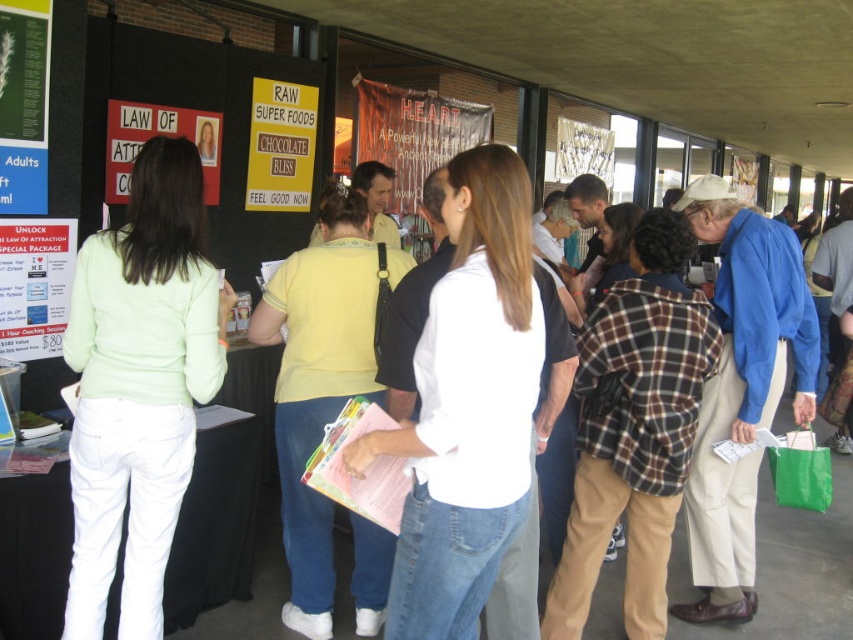
The image size is (853, 640). What do you see at coordinates (22, 68) in the screenshot? I see `green matte poster at upper left` at bounding box center [22, 68].

Where is `green matte poster at upper left`? The image size is (853, 640). green matte poster at upper left is located at coordinates (22, 68).

Which is more to the right, yellow paper sign at center or matte red poster at upper left?

From the viewer's perspective, yellow paper sign at center appears more on the right side.

Image resolution: width=853 pixels, height=640 pixels. What do you see at coordinates (281, 145) in the screenshot?
I see `yellow paper sign at center` at bounding box center [281, 145].

I want to click on yellow paper sign at center, so click(x=281, y=145).

Identify the location of yellow paper sign at center. (281, 145).

Consider the image. Can you confirm if matte red poster at upper left is positioned below white paper at upper center?

Yes.

Which of these two, matte red poster at upper left or white paper at upper center, stands shorter?

matte red poster at upper left is shorter.

The width and height of the screenshot is (853, 640). Describe the element at coordinates (158, 134) in the screenshot. I see `matte red poster at upper left` at that location.

You are a GUI agent. You are given a task and a screenshot of the screen. Output one action in this format:
    pyautogui.click(x=<x>, y=<y>)
    Task: Click on the matte red poster at upper left
    The height and width of the screenshot is (640, 853).
    Given the screenshot: What is the action you would take?
    pyautogui.click(x=158, y=134)